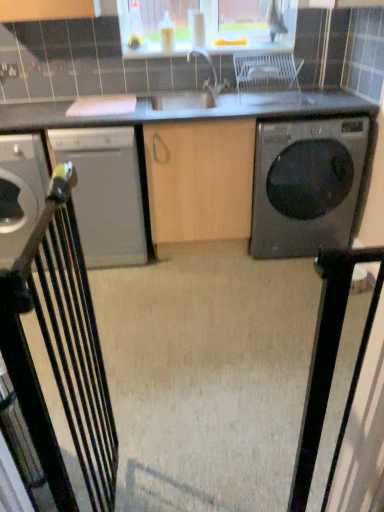
Question: Which is correct: white plastic chair at center, which appears as the 1th chair when viewed from the top, is inside metallic gray dishwasher at left, which is the 2th home appliance from right to left, or outside of it?

Choices:
 (A) inside
 (B) outside

Answer: (B)

Question: Does point (253, 72) appear closer or farther from the camera than point (19, 206)?

Choices:
 (A) farther
 (B) closer

Answer: (A)

Question: Which is nearer to the satin white dishwasher at left, placed as the 2th home appliance when sorted from left to right?

Choices:
 (A) metallic black gate at left, marked as the second chair in a right-to-left arrangement
 (B) white plastic chair at center, which appears as the 2th chair when ordered from the bottom
 (C) metallic gray dishwasher at left, which is the 2th home appliance from right to left
 (D) black glossy washing machine at right

Answer: (C)

Question: Which object is positioned farthest from the metallic black gate at left, the 2th chair positioned from the top?

Choices:
 (A) metallic gray dishwasher at left, which is the 2th home appliance from right to left
 (B) white plastic chair at center, the 1th chair viewed from the back
 (C) black glossy washing machine at right
 (D) satin white dishwasher at left, marked as the first home appliance in a right-to-left arrangement

Answer: (B)